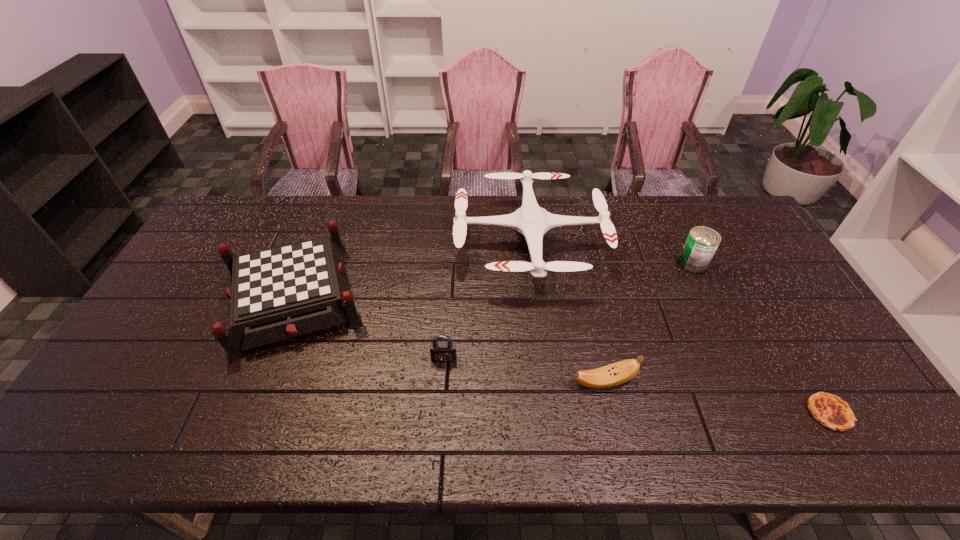
In order to click on vacant region that satisfies the following two spatial constraints: 1. on the back side of the can; 2. with the camera attached at the bottom of the drone in this screenshot , I will do `click(683, 243)`.

I want to click on free space that satisfies the following two spatial constraints: 1. on the front of the padlock near the keyhole; 2. on the left side of the banana, so click(x=443, y=382).

At what (x,y) coordinates should I click in order to perform the action: click on free space that satisfies the following two spatial constraints: 1. on the front of the second nearest object near the keyhole; 2. on the right side of the padlock. Please return your answer as a coordinate pair (x, y). This screenshot has width=960, height=540. Looking at the image, I should click on (443, 382).